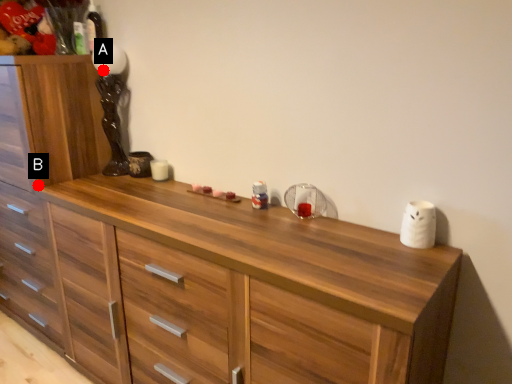
Question: Two points are circled on the image, labeled by A and B beside each circle. Which point is closer to the camera?

Choices:
 (A) A is closer
 (B) B is closer

Answer: (B)